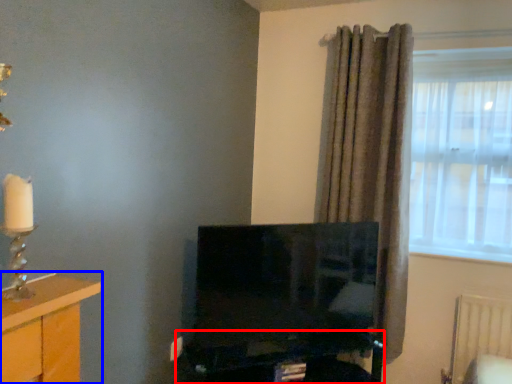
Question: Among these objects, which one is farthest to the camera, computer desk (highlighted by a red box) or furniture (highlighted by a blue box)?

Choices:
 (A) computer desk
 (B) furniture

Answer: (A)